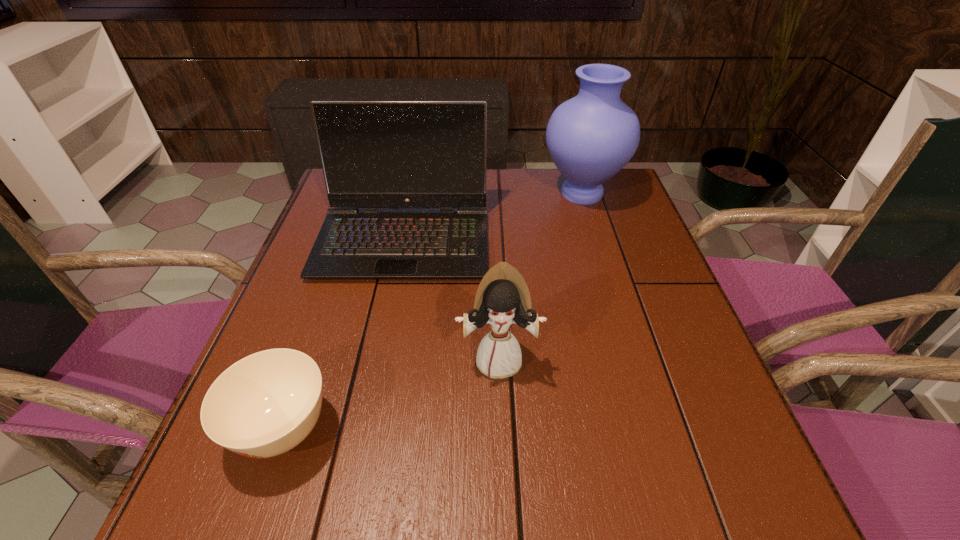
You are a GUI agent. You are given a task and a screenshot of the screen. Output one action in this format:
    pyautogui.click(x=<x>, y=<y>)
    Task: Click on the vase that is at the far edge
    The height and width of the screenshot is (540, 960).
    Given the screenshot: What is the action you would take?
    pyautogui.click(x=591, y=137)

This screenshot has width=960, height=540. I want to click on laptop computer located in the far edge section of the desktop, so click(375, 154).

Locate an element on the screen. This screenshot has width=960, height=540. object positioned at the near edge is located at coordinates (264, 405).

At what (x,y) coordinates should I click in order to perform the action: click on laptop computer that is positioned at the left edge. Please return your answer as a coordinate pair (x, y). Looking at the image, I should click on (375, 154).

I want to click on sugar bowl present at the left edge, so click(264, 405).

Find the location of a particular element. This screenshot has height=540, width=960. object at the right edge is located at coordinates (591, 137).

Find the location of a particular element. object present at the far left corner is located at coordinates (375, 154).

Where is `object that is at the near left corner`? The height and width of the screenshot is (540, 960). object that is at the near left corner is located at coordinates (264, 405).

Locate an element on the screen. This screenshot has height=540, width=960. object located at the far right corner is located at coordinates (591, 137).

This screenshot has width=960, height=540. Find the location of `free space at the far edge`. free space at the far edge is located at coordinates (493, 200).